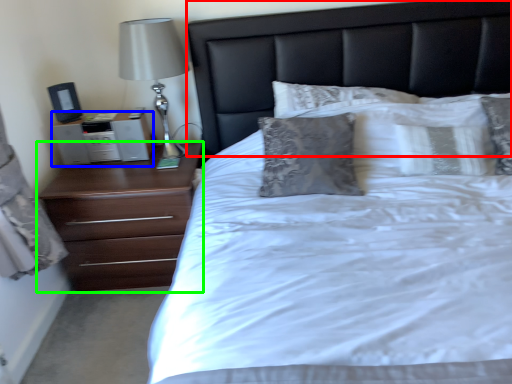
Question: Which object is the closest to the headboard (highlighted by a red box)? Choose among these: nightstand (highlighted by a blue box) or chest of drawers (highlighted by a green box).

Choices:
 (A) nightstand
 (B) chest of drawers

Answer: (B)